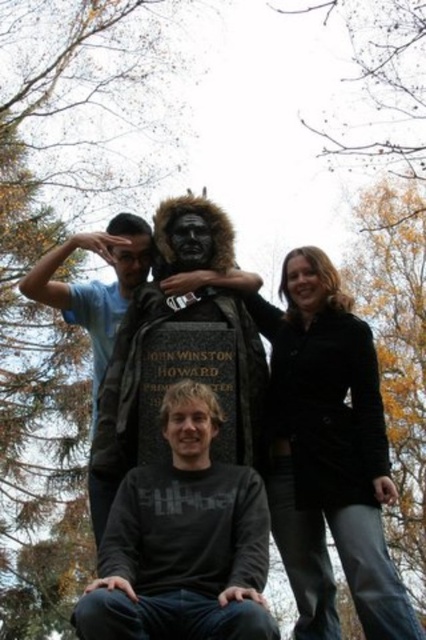
Who is lower down, matte black bust at center or matte black mask at center?

matte black mask at center

Is point (195, 221) closer to viewer compared to point (131, 236)?

Yes, point (195, 221) is in front of point (131, 236).

Locate an element on the screen. The image size is (426, 640). matte black bust at center is located at coordinates (x=190, y=241).

Is dark gray cotton shirt at center wider than smooth black hair at upper right?

Yes.

Where is `dark gray cotton shirt at center`? The height and width of the screenshot is (640, 426). dark gray cotton shirt at center is located at coordinates (181, 557).

I want to click on dark gray cotton shirt at center, so click(x=181, y=557).

Does point (282, 266) come behind point (302, 282)?

Yes, it is behind point (302, 282).

Does black woolen coat at upper right have a lesser height compared to smooth black hair at upper right?

Incorrect, black woolen coat at upper right's height does not fall short of smooth black hair at upper right's.

Where is `black woolen coat at upper right`? This screenshot has height=640, width=426. black woolen coat at upper right is located at coordinates (330, 460).